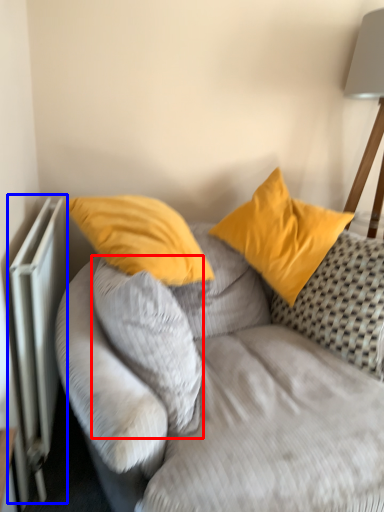
Question: Which of the following is the farthest to the observer, pillow (highlighted by a red box) or radiator (highlighted by a blue box)?

Choices:
 (A) pillow
 (B) radiator

Answer: (B)